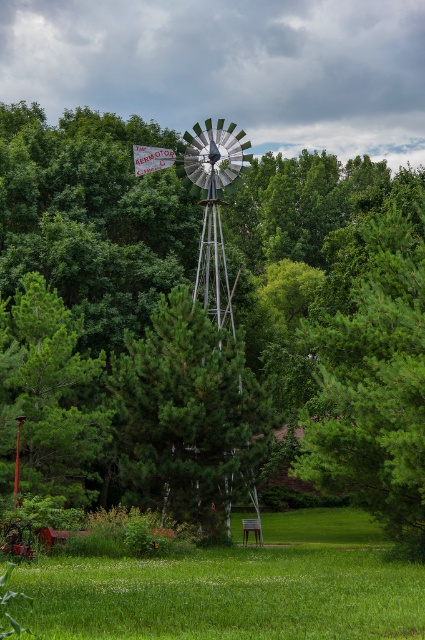
Between green leafy tree at center and green textured pine tree at center, which one appears on the left side from the viewer's perspective?

Positioned to the left is green leafy tree at center.

What do you see at coordinates (218, 314) in the screenshot? I see `green leafy tree at center` at bounding box center [218, 314].

Is point (416, 250) behind point (351, 392)?

Yes, point (416, 250) is farther from viewer.

Where is `green leafy tree at center`? green leafy tree at center is located at coordinates (218, 314).

Who is more distant from viewer, (300, 467) or (190, 483)?

Positioned behind is point (190, 483).

Which is more to the right, green textured pine tree at center or green matte tree at center?

From the viewer's perspective, green textured pine tree at center appears more on the right side.

Which is in front, point (297, 458) or point (209, 502)?

Point (209, 502) is more forward.

Find the location of a particular element. The height and width of the screenshot is (640, 425). green textured pine tree at center is located at coordinates (374, 385).

Between green leafy tree at center and green matte tree at center, which one appears on the left side from the viewer's perspective?

green leafy tree at center is more to the left.

Can you confirm if green leafy tree at center is positioned to the left of green matte tree at center?

Indeed, green leafy tree at center is positioned on the left side of green matte tree at center.

Locate an element on the screen. This screenshot has height=640, width=425. green leafy tree at center is located at coordinates (218, 314).

This screenshot has height=640, width=425. In order to click on green leafy tree at center in this screenshot , I will do `click(218, 314)`.